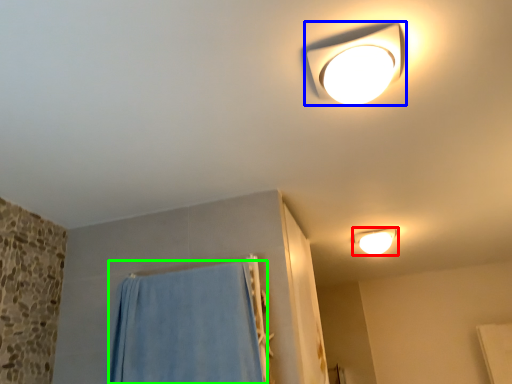
Question: Considering the real-world distances, which object is closest to lamp (highlighted by a red box)? lamp (highlighted by a blue box) or curtain (highlighted by a green box).

Choices:
 (A) lamp
 (B) curtain

Answer: (B)